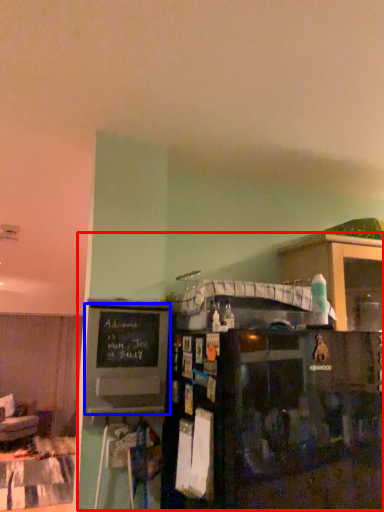
Question: Which object is closer to the camera taking this photo, entertainment center (highlighted by a red box) or bulletin board (highlighted by a blue box)?

Choices:
 (A) entertainment center
 (B) bulletin board

Answer: (A)